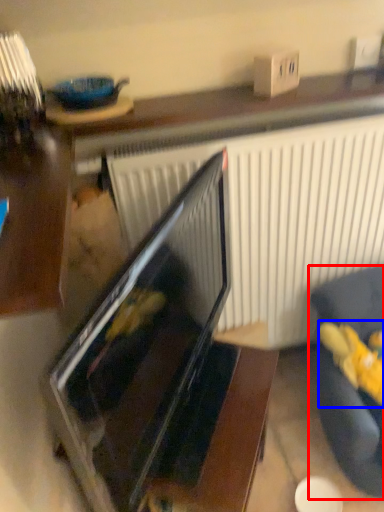
Question: Which point is further to the camera, furniture (highlighted by a red box) or stuff (highlighted by a blue box)?

Choices:
 (A) furniture
 (B) stuff

Answer: (B)